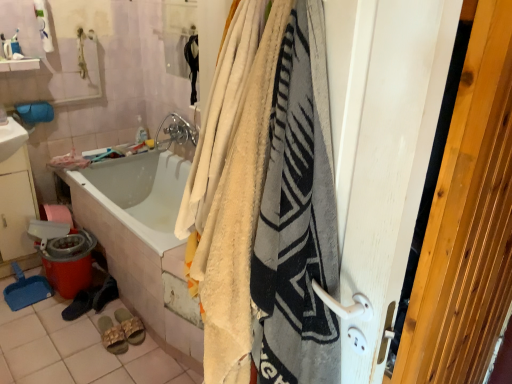
At what (x,y) coordinates should I click in order to perform the action: click on vacant region above white tile at lower left (from a real-world perspective). Please return your answer as a coordinate pair (x, y). The image size is (512, 384). Looking at the image, I should click on coord(70,331).